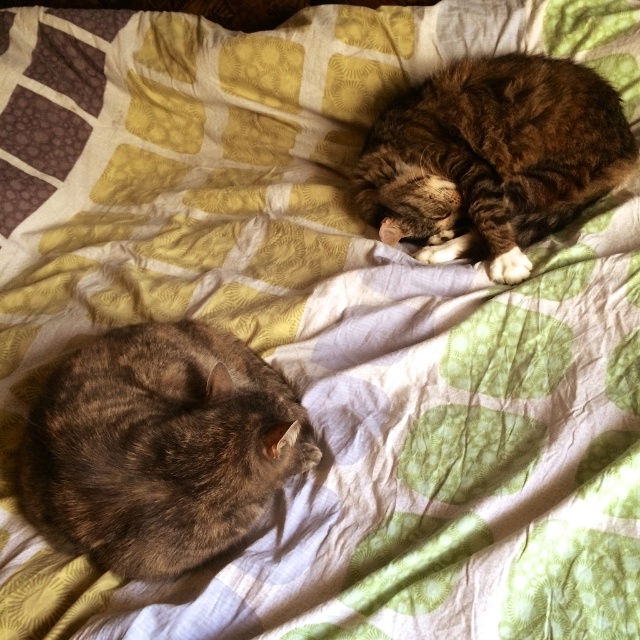
Question: Which of the following is the farthest from the observer?

Choices:
 (A) gray fur cat at lower left
 (B) tabby fur cat at upper right

Answer: (B)

Question: Among these objects, which one is nearest to the camera?

Choices:
 (A) gray fur cat at lower left
 (B) tabby fur cat at upper right

Answer: (A)

Question: Can you confirm if gray fur cat at lower left is positioned to the left of tabby fur cat at upper right?

Choices:
 (A) yes
 (B) no

Answer: (A)

Question: Among these points, which one is farthest from the camera?

Choices:
 (A) (588, 112)
 (B) (147, 371)

Answer: (A)

Question: Is gray fur cat at lower left further to camera compared to tabby fur cat at upper right?

Choices:
 (A) no
 (B) yes

Answer: (A)

Question: Is gray fur cat at lower left to the right of tabby fur cat at upper right from the viewer's perspective?

Choices:
 (A) no
 (B) yes

Answer: (A)